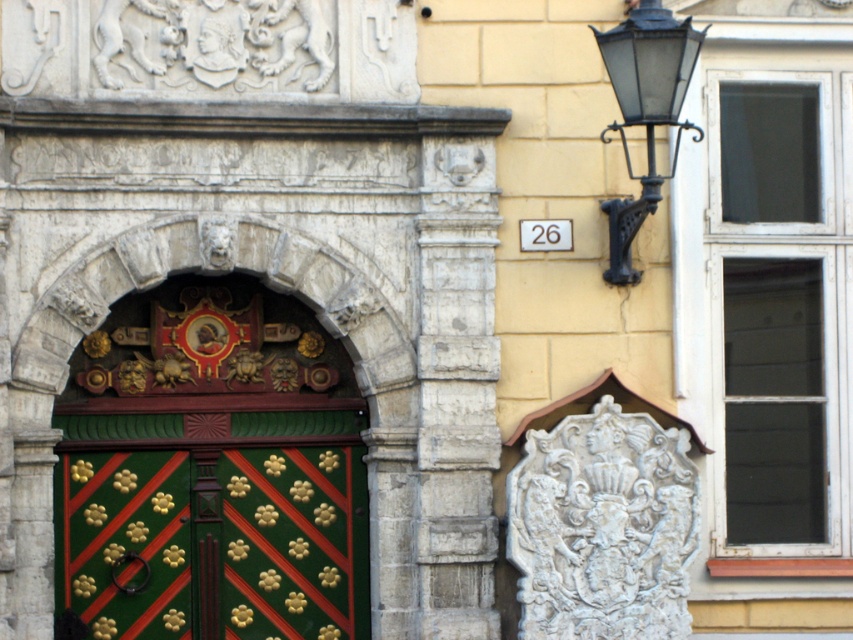
You are a visitor standing in front of the historic building. You notice the green painted wood door at center and the black wrought iron streetlamp at upper right. Which object is located above the other?

The green painted wood door at center is positioned under the black wrought iron streetlamp at upper right, so the black wrought iron streetlamp at upper right is above the green painted wood door at center.

You are a delivery person trying to enter the building. The entrance is through the green painted wood door at center. There is a black wrought iron streetlamp at upper right nearby. Which object is wider from your perspective?

The green painted wood door at center is wider than the black wrought iron streetlamp at upper right according to the description.

You are a visitor standing in front of the historic building. You notice the green painted wood door at center and the black wrought iron streetlamp at upper right. Which object is taller?

The black wrought iron streetlamp at upper right is taller than the green painted wood door at center.